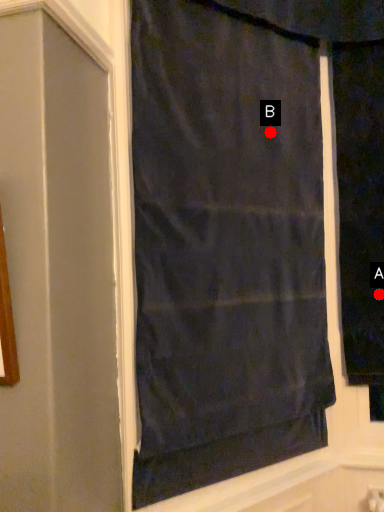
Question: Two points are circled on the image, labeled by A and B beside each circle. Which of the following is the farthest from the observer?

Choices:
 (A) A is further
 (B) B is further

Answer: (A)